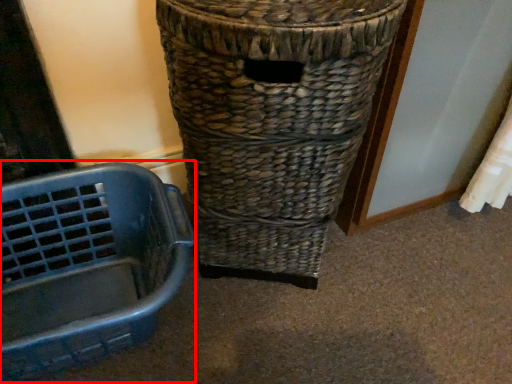
Question: From the image's perspective, considering the relative positions of basket container (annotated by the red box) and waste container in the image provided, where is basket container (annotated by the red box) located with respect to the staircase?

Choices:
 (A) below
 (B) above

Answer: (A)